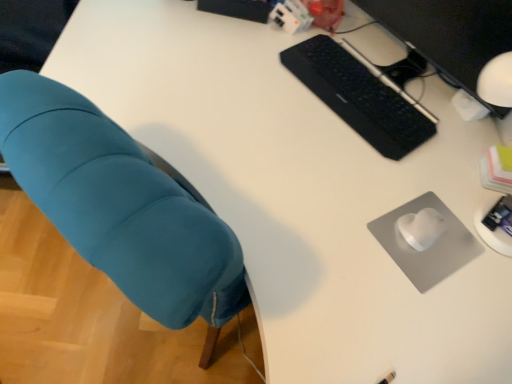
Question: Is gray matte mousepad at lower right far from black matte keyboard at upper right?

Choices:
 (A) yes
 (B) no

Answer: (B)

Question: Does gray matte mousepad at lower right have a lesser height compared to black matte keyboard at upper right?

Choices:
 (A) yes
 (B) no

Answer: (A)

Question: Considering the relative positions of gray matte mousepad at lower right and black matte keyboard at upper right in the image provided, is gray matte mousepad at lower right to the left of black matte keyboard at upper right from the viewer's perspective?

Choices:
 (A) no
 (B) yes

Answer: (A)

Question: Considering the relative positions of gray matte mousepad at lower right and black matte keyboard at upper right in the image provided, is gray matte mousepad at lower right in front of black matte keyboard at upper right?

Choices:
 (A) no
 (B) yes

Answer: (B)

Question: Is gray matte mousepad at lower right turned away from black matte keyboard at upper right?

Choices:
 (A) no
 (B) yes

Answer: (A)

Question: In terms of width, does black matte computer monitor at upper right look wider or thinner when compared to black matte keyboard at upper right?

Choices:
 (A) thin
 (B) wide

Answer: (A)

Question: In the image, is black matte computer monitor at upper right positioned in front of or behind black matte keyboard at upper right?

Choices:
 (A) front
 (B) behind

Answer: (A)

Question: From a real-world perspective, is black matte computer monitor at upper right positioned above or below black matte keyboard at upper right?

Choices:
 (A) above
 (B) below

Answer: (A)

Question: Do you think black matte computer monitor at upper right is within black matte keyboard at upper right, or outside of it?

Choices:
 (A) inside
 (B) outside

Answer: (B)

Question: From their relative heights in the image, would you say black matte keyboard at upper right is taller or shorter than gray matte mousepad at lower right?

Choices:
 (A) tall
 (B) short

Answer: (A)

Question: From the image's perspective, is black matte keyboard at upper right positioned above or below gray matte mousepad at lower right?

Choices:
 (A) above
 (B) below

Answer: (A)

Question: Is point (365, 132) closer or farther from the camera than point (412, 205)?

Choices:
 (A) closer
 (B) farther

Answer: (B)

Question: Is black matte keyboard at upper right situated inside gray matte mousepad at lower right or outside?

Choices:
 (A) outside
 (B) inside

Answer: (A)

Question: Looking at their shapes, would you say teal fabric chair at left is wider or thinner than black matte keyboard at upper right?

Choices:
 (A) wide
 (B) thin

Answer: (A)

Question: From a real-world perspective, is teal fabric chair at left above or below black matte keyboard at upper right?

Choices:
 (A) above
 (B) below

Answer: (B)